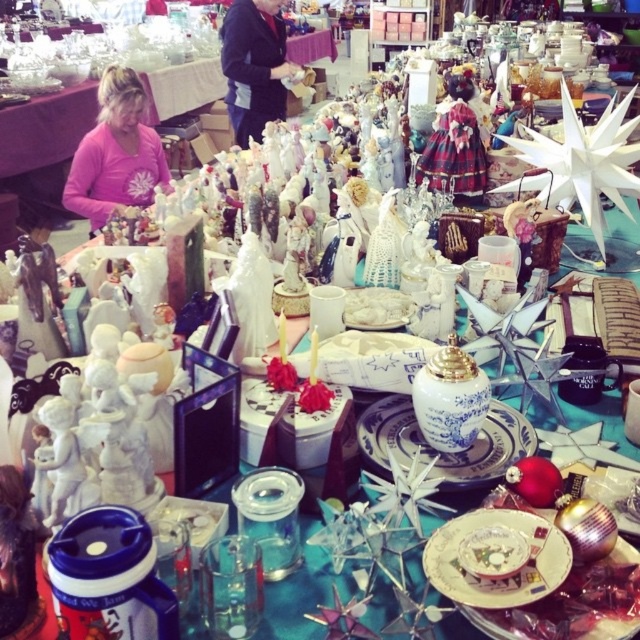
The image size is (640, 640). What do you see at coordinates (115, 154) in the screenshot? I see `pink fabric shirt at center` at bounding box center [115, 154].

Is point (154, 156) closer to camera compared to point (256, 49)?

Yes, it is in front of point (256, 49).

Who is more forward, (81, 148) or (264, 113)?

Point (81, 148) is more forward.

Where is `pink fabric shirt at center`? The width and height of the screenshot is (640, 640). pink fabric shirt at center is located at coordinates (115, 154).